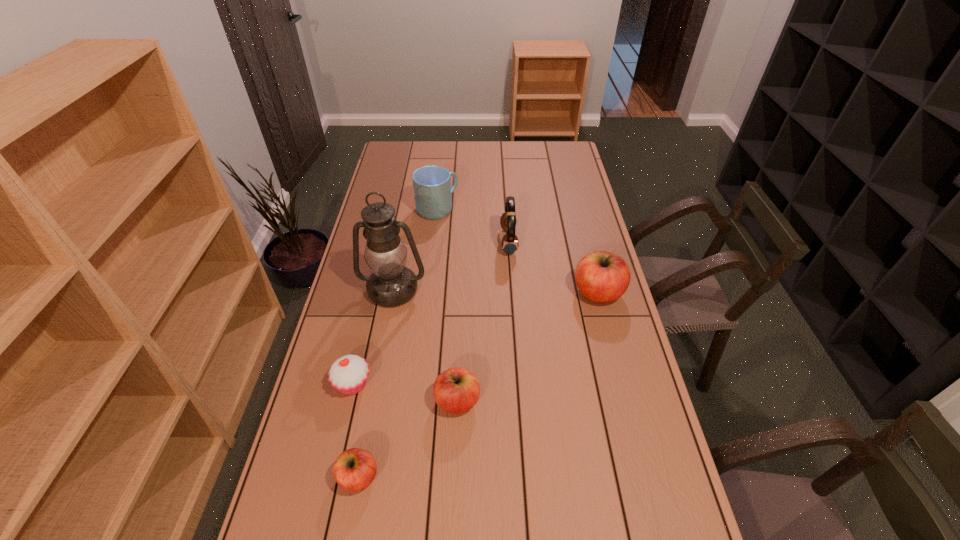
If equal spacing is the goal by inserting an additional apple among them, please point out a vacant space for this new apple. Please provide its 2D coordinates. Your answer should be formatted as a tuple, i.e. [(x, y)], where the tuple contains the x and y coordinates of a point satisfying the conditions above.

[(535, 341)]